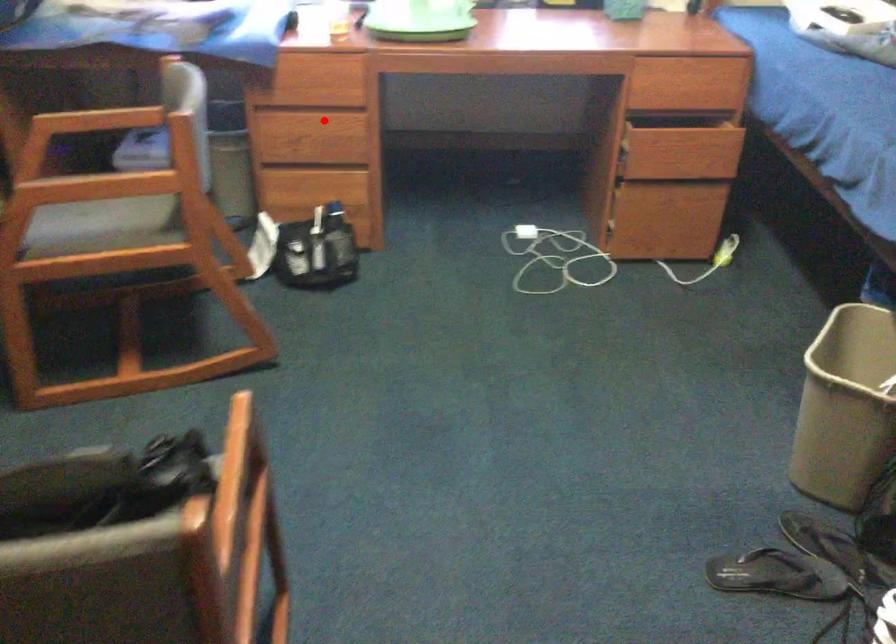
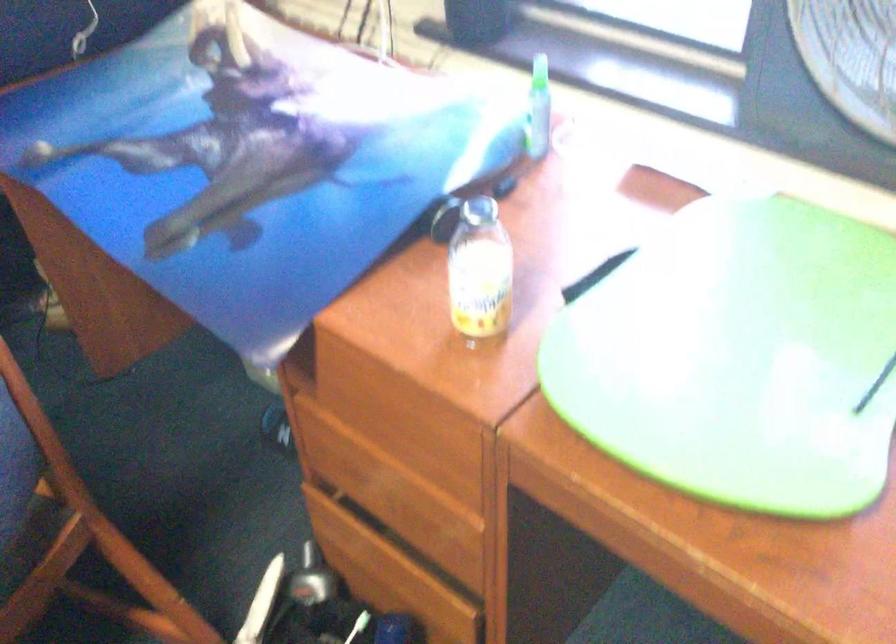
Find the pixel in the second image that matches the highlighted location in the first image.

(408, 485)